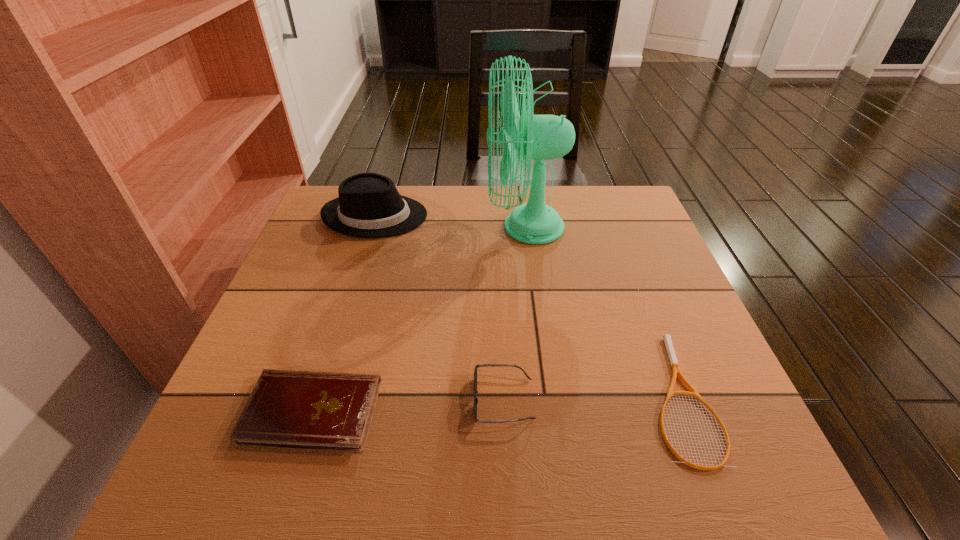
The width and height of the screenshot is (960, 540). What are the coordinates of `vacant position at the far right corner of the desktop` in the screenshot? It's located at (639, 232).

This screenshot has width=960, height=540. Find the location of `unoccupied area between the fourth shortest object and the notebook`. unoccupied area between the fourth shortest object and the notebook is located at coordinates (344, 313).

The image size is (960, 540). In order to click on unoccupied area between the fan and the fedora in this screenshot , I will do `click(450, 221)`.

Where is `free spot between the third tallest object and the fan`? free spot between the third tallest object and the fan is located at coordinates (515, 313).

Image resolution: width=960 pixels, height=540 pixels. What are the coordinates of `vacant area between the sunglasses and the fan` in the screenshot? It's located at point(515,313).

Locate an element on the screen. This screenshot has height=540, width=960. unoccupied area between the third shortest object and the second tallest object is located at coordinates [440, 308].

The height and width of the screenshot is (540, 960). In order to click on vacant space in between the notebook and the fan in this screenshot , I will do `click(419, 319)`.

In order to click on empty space that is in between the third shortest object and the notebook in this screenshot , I will do `click(408, 406)`.

This screenshot has width=960, height=540. What are the coordinates of `free space between the second tallest object and the tallest object` in the screenshot? It's located at (450, 221).

Locate an element on the screen. free space between the tallest object and the fedora is located at coordinates (450, 221).